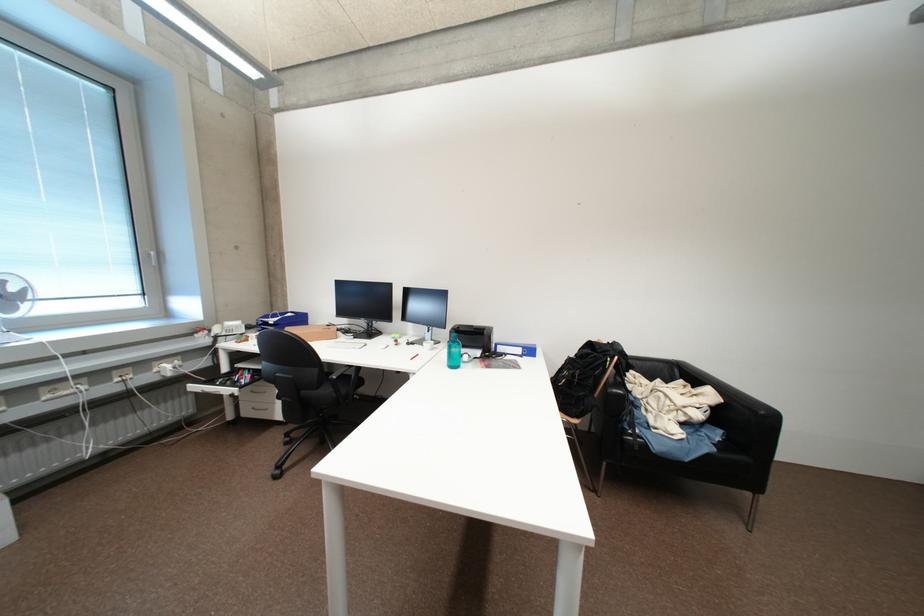
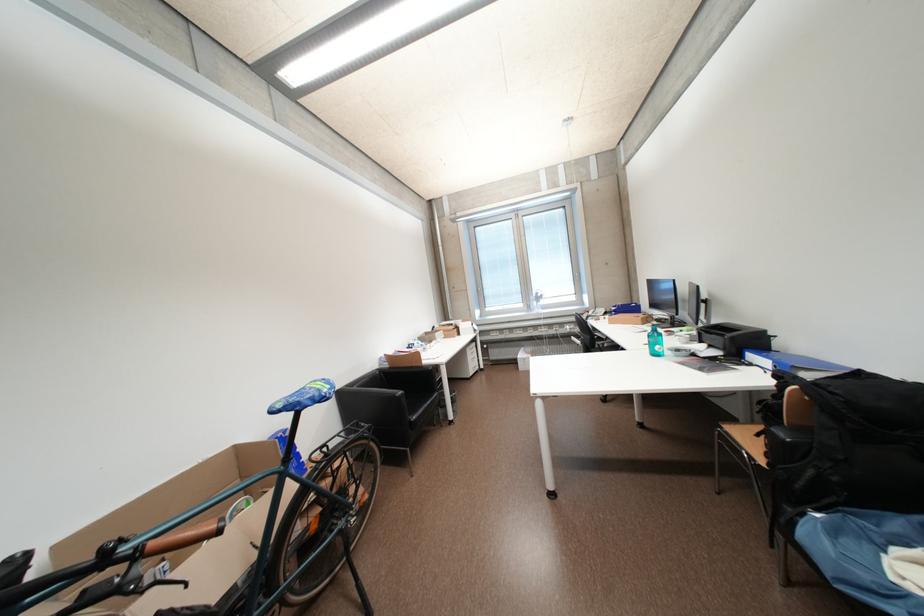
Question: I am providing you with two images of the same scene from different viewpoints. Which of the following objects are not visible in image2?

Choices:
 (A) chair sitting surface
 (B) black sofa armrest
 (C) blue package of wipes
 (D) black brake lever

Answer: (A)